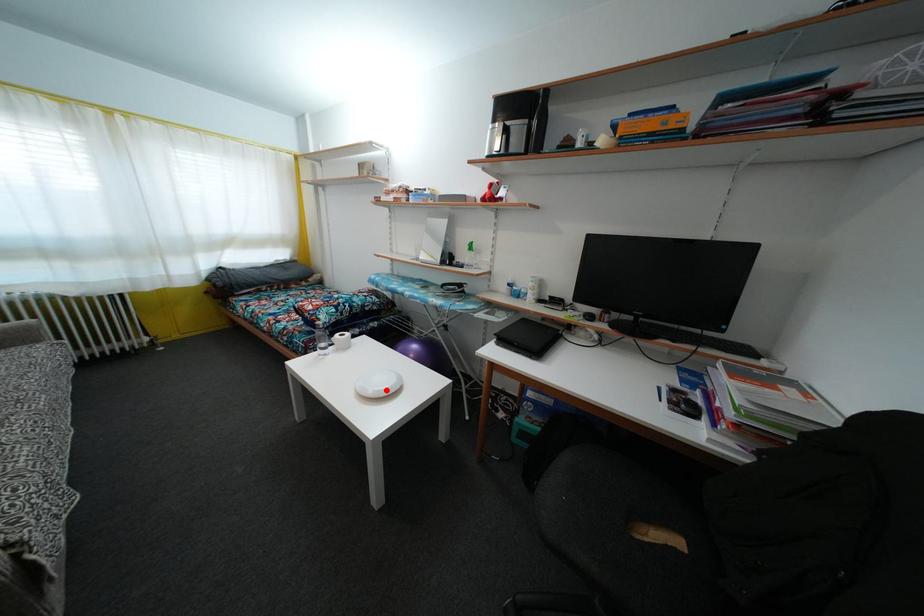
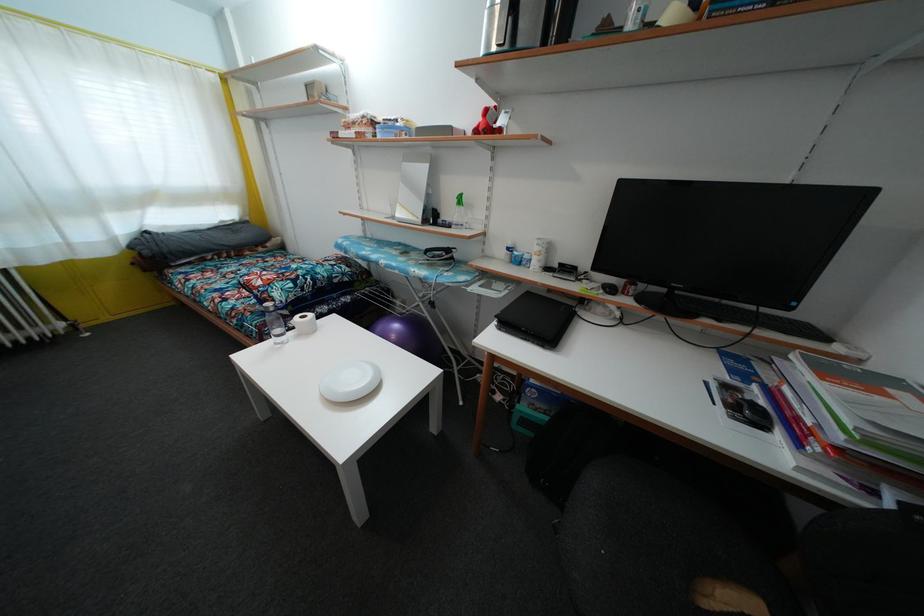
In the second image, find the point that corresponds to the highlighted location in the first image.

(359, 387)